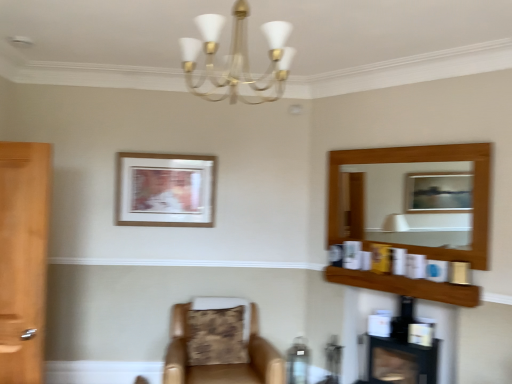
Question: Is wooden picture frame at upper center at the right side of black glossy fireplace at lower right?

Choices:
 (A) no
 (B) yes

Answer: (A)

Question: Considering the relative positions of wooden picture frame at upper center and black glossy fireplace at lower right in the image provided, is wooden picture frame at upper center behind black glossy fireplace at lower right?

Choices:
 (A) no
 (B) yes

Answer: (B)

Question: Does wooden picture frame at upper center have a smaller size compared to black glossy fireplace at lower right?

Choices:
 (A) yes
 (B) no

Answer: (A)

Question: Can you confirm if wooden picture frame at upper center is positioned to the left of black glossy fireplace at lower right?

Choices:
 (A) yes
 (B) no

Answer: (A)

Question: Is wooden picture frame at upper center aimed at black glossy fireplace at lower right?

Choices:
 (A) no
 (B) yes

Answer: (A)

Question: Can you confirm if wooden picture frame at upper center is wider than black glossy fireplace at lower right?

Choices:
 (A) yes
 (B) no

Answer: (B)

Question: Can you confirm if matte brown table at lower center is wider than leather at center?

Choices:
 (A) no
 (B) yes

Answer: (A)

Question: Is matte brown table at lower center taller than leather at center?

Choices:
 (A) yes
 (B) no

Answer: (B)

Question: Can we say matte brown table at lower center lies outside leather at center?

Choices:
 (A) no
 (B) yes

Answer: (B)

Question: Does matte brown table at lower center turn towards leather at center?

Choices:
 (A) no
 (B) yes

Answer: (B)

Question: Is matte brown table at lower center shorter than leather at center?

Choices:
 (A) no
 (B) yes

Answer: (B)

Question: Are matte brown table at lower center and leather at center making contact?

Choices:
 (A) no
 (B) yes

Answer: (A)

Question: Is black glossy fireplace at lower right next to gold metallic chandelier at upper center and touching it?

Choices:
 (A) yes
 (B) no

Answer: (B)